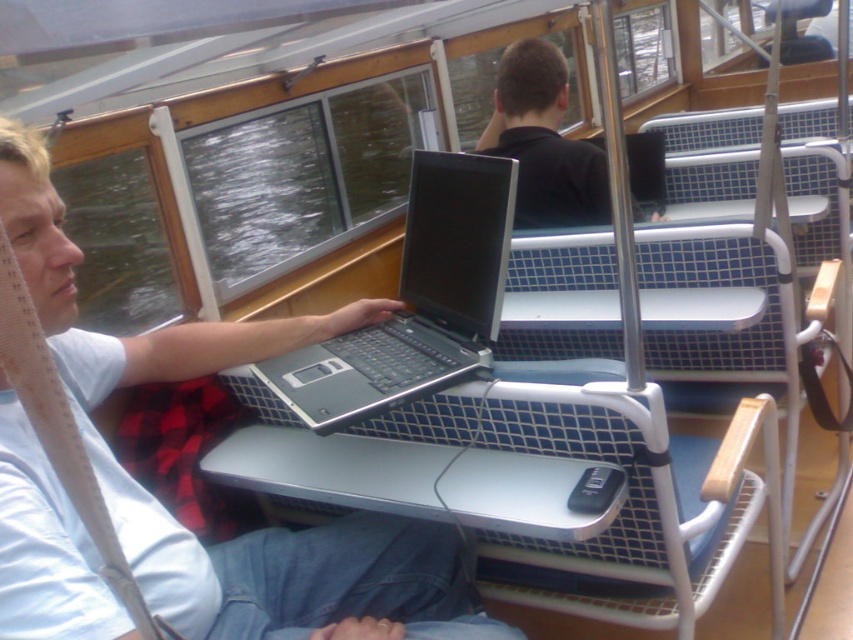
Does silver/black laptop at center have a greater height compared to black matte shirt at upper center?

In fact, silver/black laptop at center may be shorter than black matte shirt at upper center.

Locate an element on the screen. Image resolution: width=853 pixels, height=640 pixels. silver/black laptop at center is located at coordinates (416, 301).